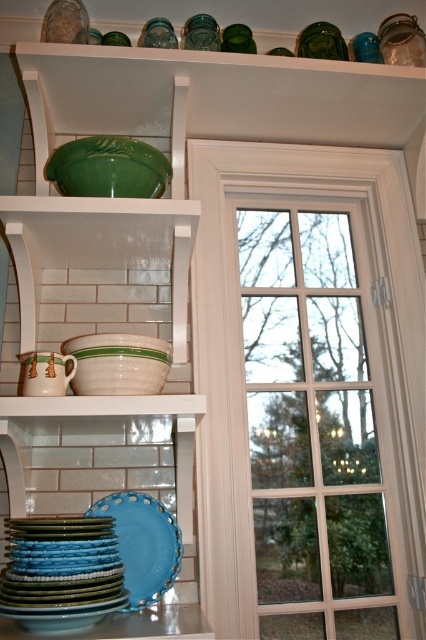
You are standing in the kitchen and want to reach the point at coordinates (23, 618). If your arm can extend 30 inches, can you reach that point?

The point at coordinates (23, 618) is 33.21 inches from the camera, which is beyond your arm reach of 30 inches. You cannot reach it.

In the scene shown: You are organizing the kitchen shelves and want to place a new decorative item between the blue glossy platter at lower left and the blue matte platter at lower left. Is there enough vertical space between them to fit an item that is 3 inches tall?

The blue glossy platter at lower left is above the blue matte platter at lower left, but the exact vertical distance between them isn not specified. Without knowing the space between, it is impossible to determine if a 3 inch tall item would fit.

You are arranging dishes in the kitchen and need to place a new dish on the bottom shelf. The shelf has limited space. Which platter, the blue glossy platter at lower left or the blue matte platter at lower left, should you choose to fit better in the remaining space?

The blue matte platter at lower left should be chosen because its smaller width compared to the blue glossy platter at lower left allows it to fit better in the limited space.